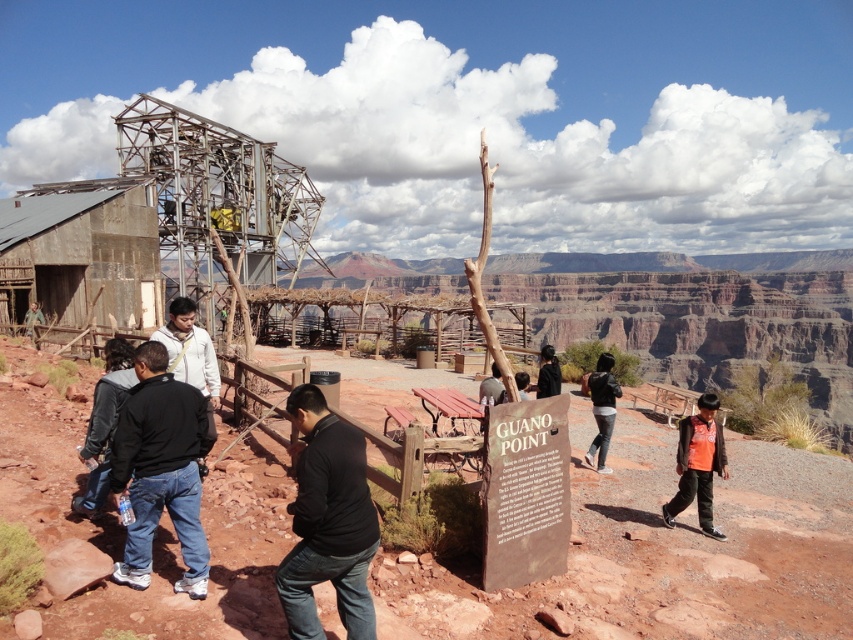
Question: Does dark gray jacket at center lie in front of matte black jacket at lower left?

Choices:
 (A) no
 (B) yes

Answer: (B)

Question: Which of these objects is positioned farthest from the dark gray jacket at lower left?

Choices:
 (A) dark gray jacket at center
 (B) black matte jacket at lower left
 (C) matte black jacket at lower left

Answer: (C)

Question: Among these objects, which one is farthest from the camera?

Choices:
 (A) dark gray jacket at center
 (B) white matte jacket at center
 (C) black fabric jacket at center

Answer: (C)

Question: Which point appears closest to the camera in this image?

Choices:
 (A) (35, 316)
 (B) (154, 353)
 (C) (318, 620)
 (D) (537, 381)

Answer: (C)

Question: Can you confirm if black leather jacket at center is bigger than black fabric jacket at center?

Choices:
 (A) no
 (B) yes

Answer: (A)

Question: From the image, what is the correct spatial relationship of dark gray jacket at center in relation to matte black jacket at lower left?

Choices:
 (A) left
 (B) right

Answer: (B)